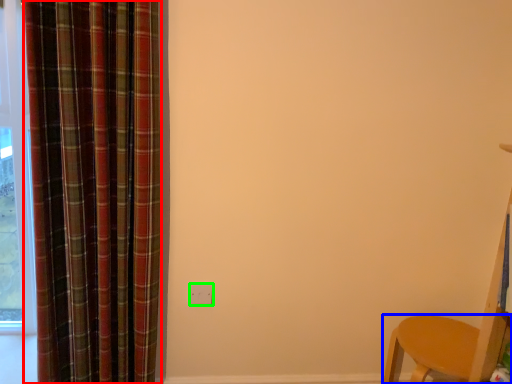
Question: Considering the real-world distances, which object is farthest from curtain (highlighted by a red box)? furniture (highlighted by a blue box) or electric outlet (highlighted by a green box)?

Choices:
 (A) furniture
 (B) electric outlet

Answer: (A)